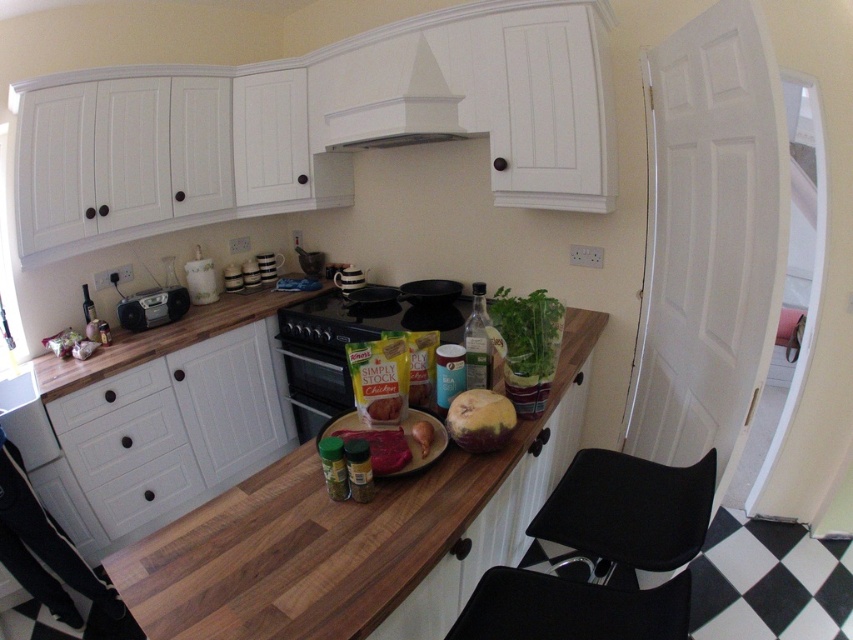
You are a chef preparing to store ingredients. You have a smooth brown chicken at center that needs to be placed in the white matte drawer at lower left. Can you reach the drawer without moving the chicken?

The white matte drawer at lower left is further to the viewer than the smooth brown chicken at center, so it is closer to you. This means you can reach the drawer without needing to move the chicken since it is in front of the chicken.